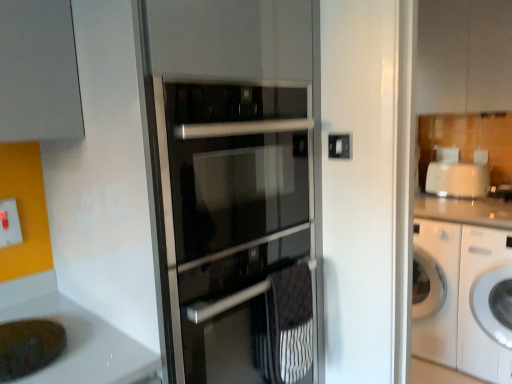
Question: From a real-world perspective, is black textured towel at center above or below white glossy washing machine at right?

Choices:
 (A) below
 (B) above

Answer: (B)

Question: Is black textured towel at center in front of or behind white glossy washing machine at right in the image?

Choices:
 (A) behind
 (B) front

Answer: (B)

Question: Which is nearer to the matte white sink at lower left?

Choices:
 (A) black textured towel at center
 (B) white glossy washing machine at right
 (C) white glossy cabinet at upper center
 (D) white plastic electric outlet at lower left

Answer: (D)

Question: Estimate the real-world distances between objects in this image. Which object is farther from the matte white sink at lower left?

Choices:
 (A) white glossy cabinet at upper center
 (B) white glossy washing machine at right
 (C) black textured towel at center
 (D) white plastic electric outlet at lower left

Answer: (A)